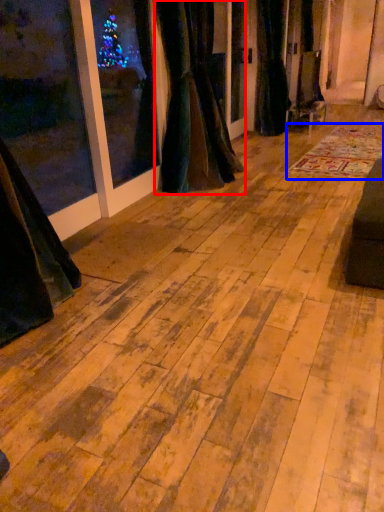
Question: Among these objects, which one is farthest to the camera, curtain (highlighted by a red box) or mat (highlighted by a blue box)?

Choices:
 (A) curtain
 (B) mat

Answer: (B)